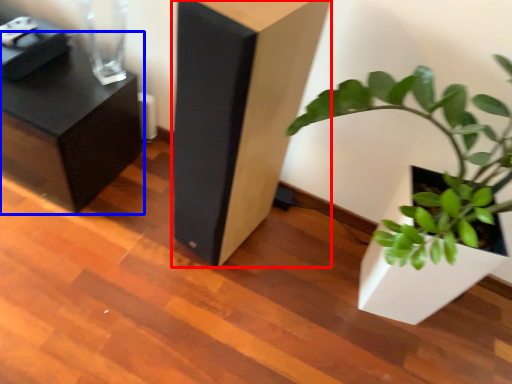
Question: Which object is closer to the camera taking this photo, furniture (highlighted by a red box) or furniture (highlighted by a blue box)?

Choices:
 (A) furniture
 (B) furniture

Answer: (A)